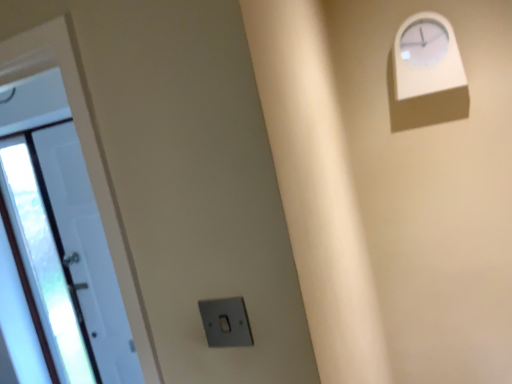
Question: Is satin silver switch at lower center at the right side of white glossy door at left?

Choices:
 (A) no
 (B) yes

Answer: (B)

Question: Can you confirm if satin silver switch at lower center is positioned to the left of white glossy door at left?

Choices:
 (A) yes
 (B) no

Answer: (B)

Question: Is satin silver switch at lower center in front of white glossy door at left?

Choices:
 (A) no
 (B) yes

Answer: (B)

Question: Is satin silver switch at lower center shorter than white glossy door at left?

Choices:
 (A) yes
 (B) no

Answer: (A)

Question: Is satin silver switch at lower center in contact with white glossy door at left?

Choices:
 (A) yes
 (B) no

Answer: (B)

Question: Does satin silver switch at lower center come behind white glossy door at left?

Choices:
 (A) yes
 (B) no

Answer: (B)

Question: Considering the relative sizes of white plastic clock at upper right and white glossy door at left in the image provided, is white plastic clock at upper right taller than white glossy door at left?

Choices:
 (A) yes
 (B) no

Answer: (B)

Question: Does white plastic clock at upper right appear on the left side of white glossy door at left?

Choices:
 (A) yes
 (B) no

Answer: (B)

Question: From a real-world perspective, is white plastic clock at upper right physically above white glossy door at left?

Choices:
 (A) no
 (B) yes

Answer: (B)

Question: Is white plastic clock at upper right outside white glossy door at left?

Choices:
 (A) no
 (B) yes

Answer: (B)

Question: Can you confirm if white plastic clock at upper right is thinner than white glossy door at left?

Choices:
 (A) no
 (B) yes

Answer: (A)

Question: Is white plastic clock at upper right oriented towards white glossy door at left?

Choices:
 (A) yes
 (B) no

Answer: (B)

Question: From a real-world perspective, is white glossy door at left physically above satin silver switch at lower center?

Choices:
 (A) yes
 (B) no

Answer: (B)